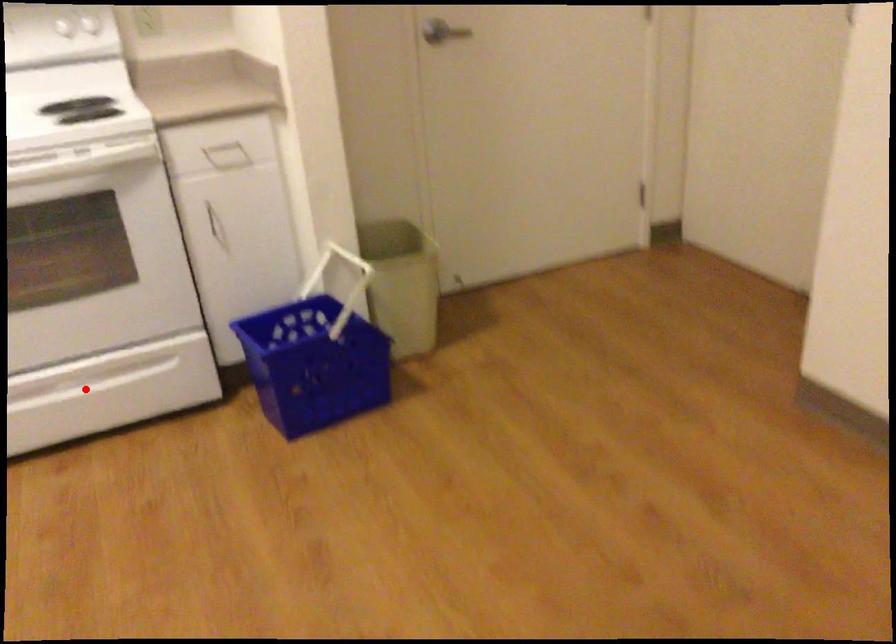
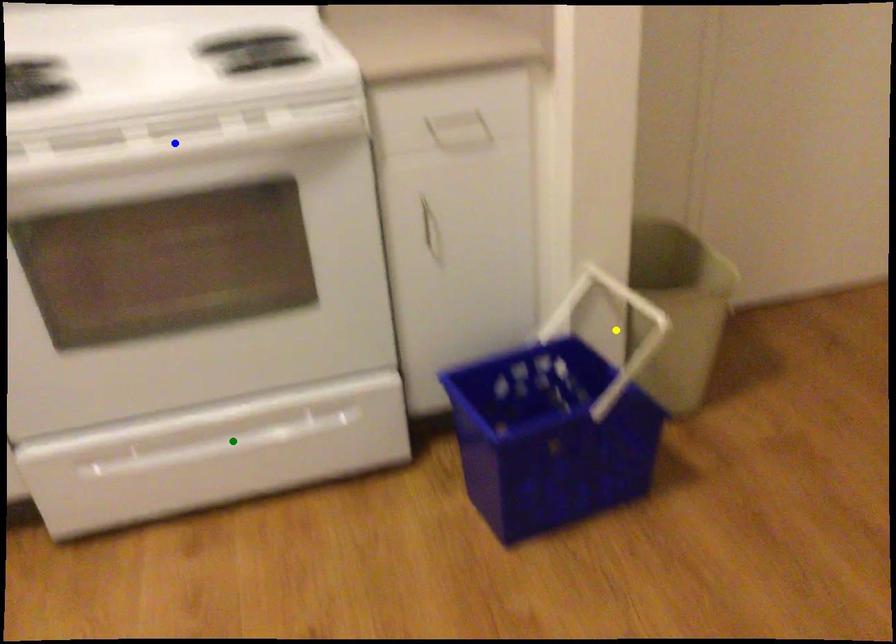
Question: I am providing you with two images of the same scene from different viewpoints. A red point is marked on the first image. You are given multiple points on the second image. Which mark in image 2 goes with the point in image 1?

Choices:
 (A) blue point
 (B) green point
 (C) yellow point

Answer: (B)